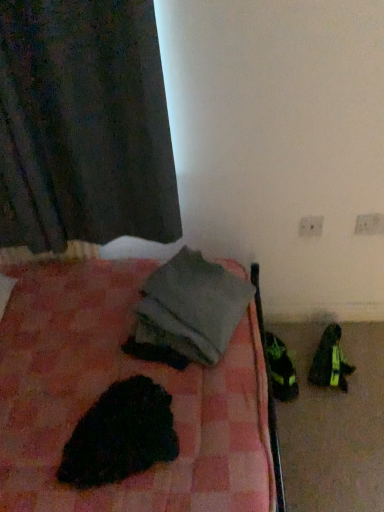
Question: Is point (137, 411) closer or farther from the camera than point (140, 313)?

Choices:
 (A) closer
 (B) farther

Answer: (A)

Question: Is black fuzzy animal at lower left in front of or behind gray fabric at center in the image?

Choices:
 (A) front
 (B) behind

Answer: (A)

Question: Which object is the farthest from the dark matte fabric curtain at upper left?

Choices:
 (A) white plastic electric outlet at upper right, positioned as the first electric outlet in left-to-right order
 (B) shiny black shoes at lower right
 (C) gray fabric at center
 (D) white plastic electric outlet at upper right, which is counted as the 1th electric outlet, starting from the right
 (E) black fuzzy animal at lower left

Answer: (B)

Question: Considering the real-world distances, which object is closest to the black fuzzy animal at lower left?

Choices:
 (A) shiny black shoes at lower right
 (B) white plastic electric outlet at upper right, which is counted as the 1th electric outlet, starting from the right
 (C) gray fabric at center
 (D) white plastic electric outlet at upper right, positioned as the first electric outlet in left-to-right order
 (E) dark matte fabric curtain at upper left

Answer: (C)